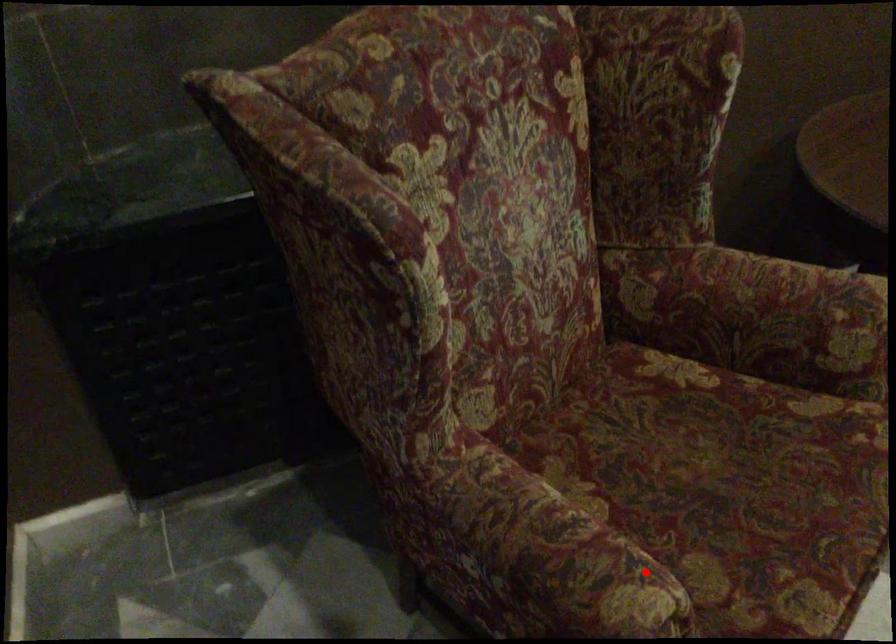
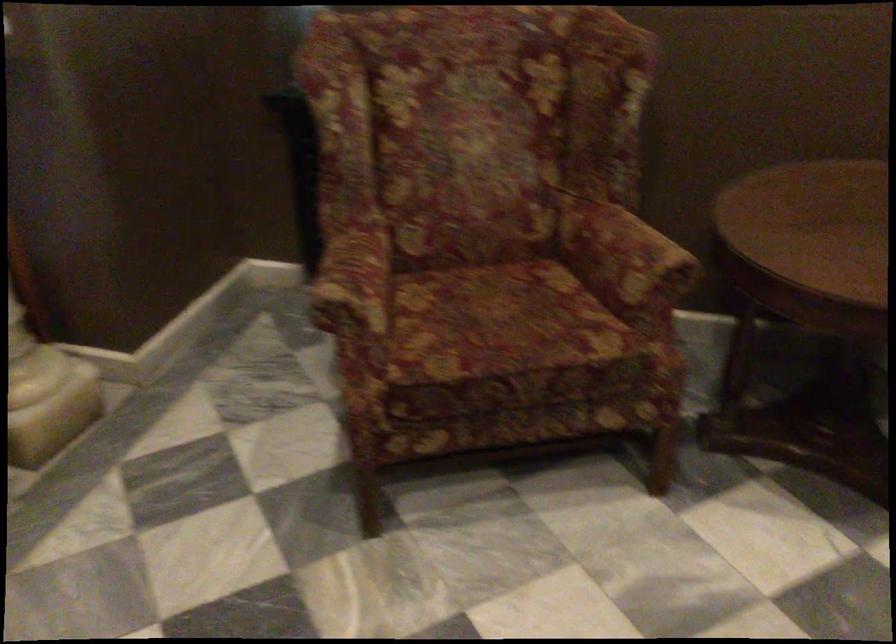
Question: I am providing you with two images of the same scene from different viewpoints. A red point is shown in image1. For the corresponding object point in image2, is it positioned nearer or farther from the camera?

Choices:
 (A) Nearer
 (B) Farther

Answer: (B)